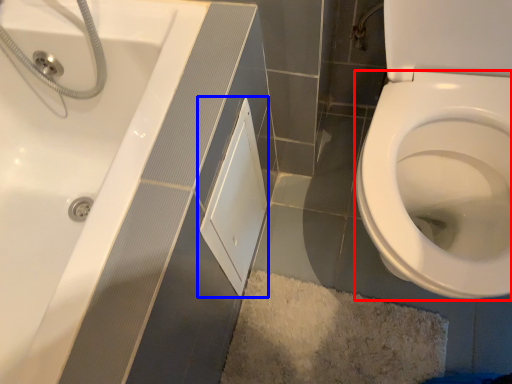
Question: Among these objects, which one is nearest to the camera, bidet (highlighted by a red box) or screen door (highlighted by a blue box)?

Choices:
 (A) bidet
 (B) screen door

Answer: (A)